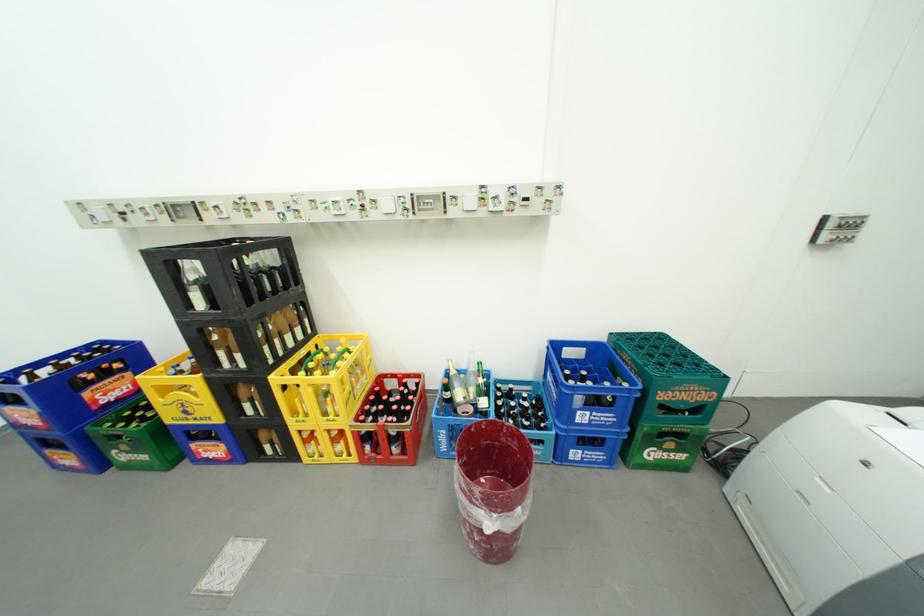
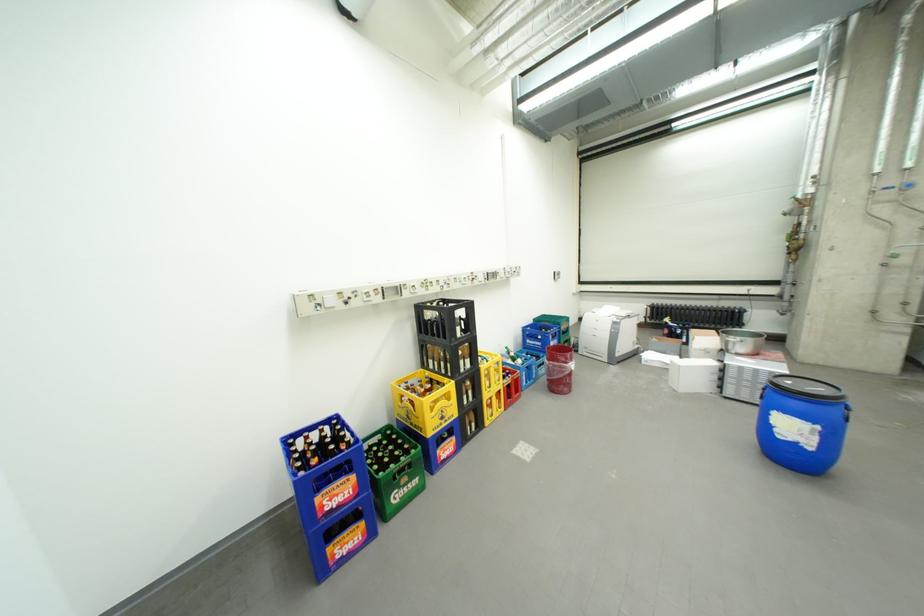
In the second image, find the point that corresponds to the point at 697,355 in the first image.

(565, 317)